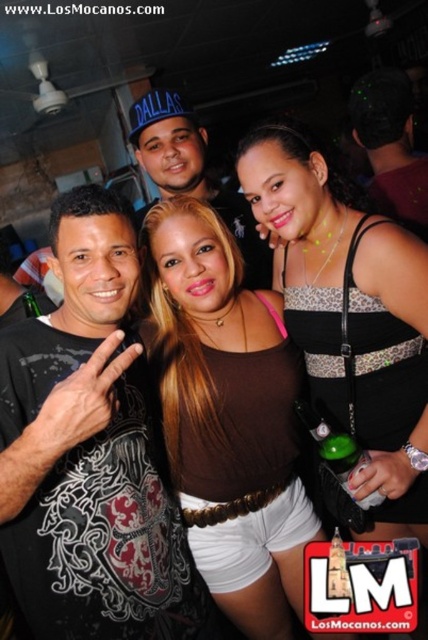
Can you confirm if brown matte tank top at center is positioned above matte black cap at upper center?

No, brown matte tank top at center is not above matte black cap at upper center.

Does point (249, 416) come closer to viewer compared to point (413, 104)?

Yes, point (249, 416) is in front of point (413, 104).

Image resolution: width=428 pixels, height=640 pixels. I want to click on brown matte tank top at center, so click(228, 417).

Can you confirm if leopard print tank top at center is positioned above matte blue cap at center?

Incorrect, leopard print tank top at center is not positioned above matte blue cap at center.

Who is higher up, leopard print tank top at center or matte blue cap at center?

matte blue cap at center is above.

Does point (401, 340) lie behind point (151, 141)?

No, (401, 340) is closer to viewer.

Locate an element on the screen. leopard print tank top at center is located at coordinates (350, 316).

Is point (113, 612) positioned in front of point (246, 513)?

Yes.

From the picture: Does black printed t-shirt at center have a lesser width compared to brown matte tank top at center?

Yes.

Does point (131, 435) come behind point (255, 573)?

No, (131, 435) is closer to viewer.

This screenshot has width=428, height=640. In order to click on black printed t-shirt at center in this screenshot , I will do `click(91, 452)`.